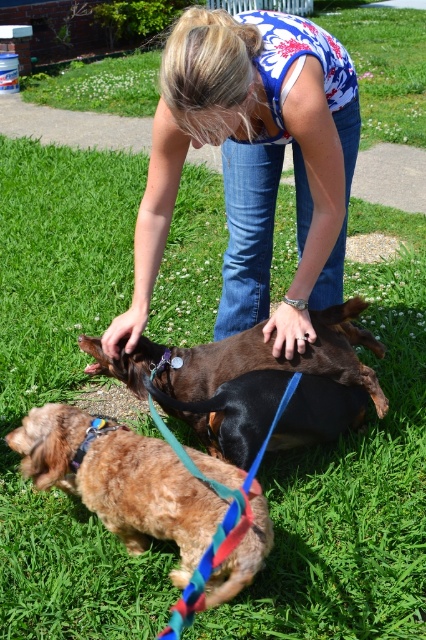
Can you confirm if blue floral tank top at center is thinner than shiny brown fur at lower left?

No.

Between blue floral tank top at center and shiny brown fur at lower left, which one has more height?

With more height is blue floral tank top at center.

Is point (279, 88) more distant than point (112, 454)?

No, it is not.

Find the location of a particular element. The width and height of the screenshot is (426, 640). blue floral tank top at center is located at coordinates (253, 163).

Which is more to the right, brown glossy dog at center or shiny brown fur at lower left?

From the viewer's perspective, brown glossy dog at center appears more on the right side.

In the scene shown: Who is more forward, (166, 404) or (92, 460)?

Point (92, 460) is in front.

Identify the location of brown glossy dog at center. The image size is (426, 640). (258, 385).

Can you confirm if blue floral tank top at center is shorter than brown glossy dog at center?

In fact, blue floral tank top at center may be taller than brown glossy dog at center.

Who is shorter, blue floral tank top at center or brown glossy dog at center?

With less height is brown glossy dog at center.

Measure the distance between point (298, 40) and camera.

Point (298, 40) and camera are 7.08 feet apart from each other.

At what (x,y) coordinates should I click in order to perform the action: click on blue floral tank top at center. Please return your answer as a coordinate pair (x, y). The height and width of the screenshot is (640, 426). Looking at the image, I should click on (253, 163).